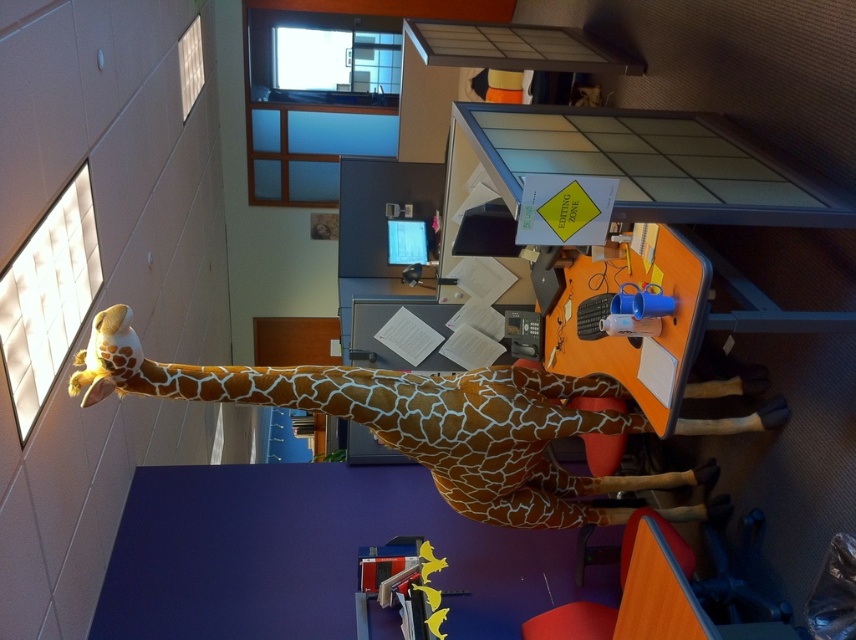
Consider the image. You are organizing a desk and need to place the brown spotted plush giraffe at center and the yellow plastic toy at lower center. Since the giraffe is taller, which object should you place first to avoid blocking the smaller one?

The brown spotted plush giraffe at center should be placed first because it is much taller than the yellow plastic toy at lower center, ensuring the smaller toy remains visible and unobstructed.

You are organizing the desk in the office scene. You need to place a new item between the brown spotted plush giraffe at center and the yellow plastic toy at lower center. Based on their positions, where should you place the new item?

The brown spotted plush giraffe at center is above the yellow plastic toy at lower center. To place the new item between them, position it below the giraffe but above the yellow plastic toy at lower center.